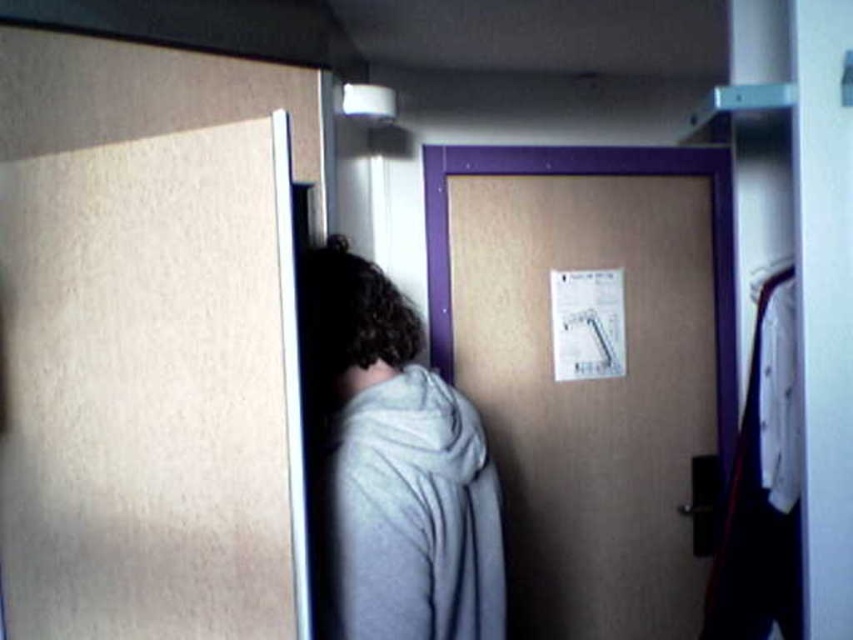
Does gray fleece robe at center have a larger size compared to wooden door at center?

No, gray fleece robe at center is not bigger than wooden door at center.

Does gray fleece robe at center appear over wooden door at center?

No, gray fleece robe at center is not above wooden door at center.

Which is behind, point (363, 579) or point (451, 326)?

Point (451, 326)

Locate an element on the screen. gray fleece robe at center is located at coordinates (413, 516).